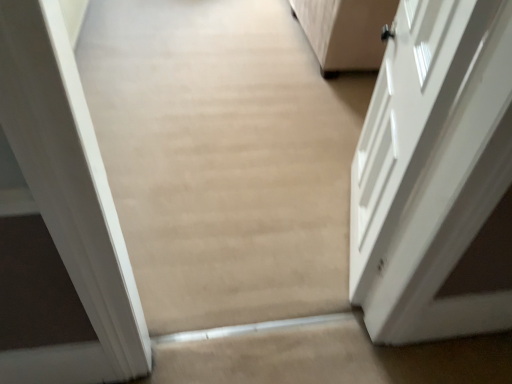
Question: Is beige carpet at center bigger or smaller than white glossy door at right?

Choices:
 (A) small
 (B) big

Answer: (A)

Question: From the image's perspective, relative to white glossy door at right, is beige carpet at center above or below?

Choices:
 (A) above
 (B) below

Answer: (B)

Question: Considering the relative positions of beige carpet at center and white glossy door at right in the image provided, is beige carpet at center to the left or to the right of white glossy door at right?

Choices:
 (A) right
 (B) left

Answer: (B)

Question: From a real-world perspective, is white glossy door at right physically located above or below beige carpet at center?

Choices:
 (A) below
 (B) above

Answer: (A)

Question: Is white glossy door at right taller or shorter than beige carpet at center?

Choices:
 (A) tall
 (B) short

Answer: (B)

Question: From the image's perspective, is white glossy door at right above or below beige carpet at center?

Choices:
 (A) below
 (B) above

Answer: (B)

Question: Based on their sizes in the image, would you say white glossy door at right is bigger or smaller than beige carpet at center?

Choices:
 (A) small
 (B) big

Answer: (B)